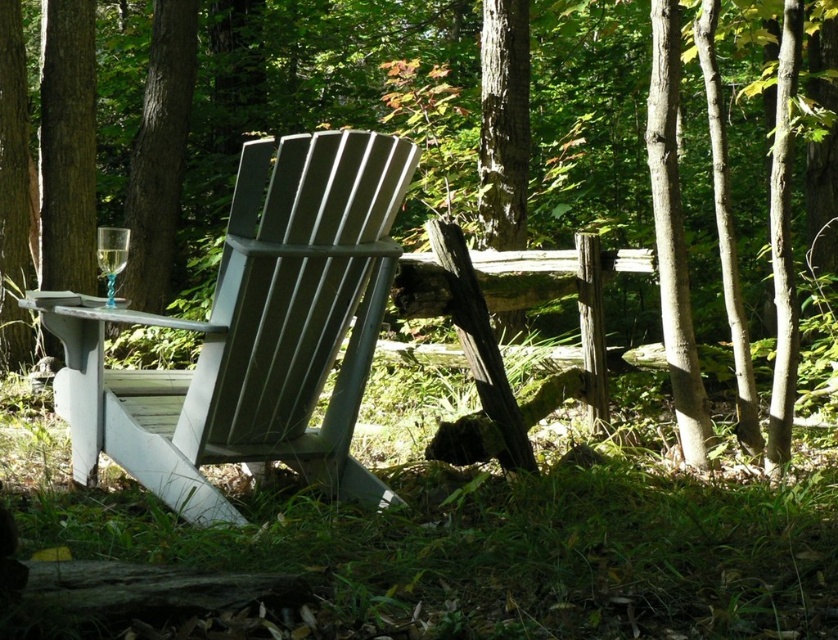
Question: Considering the real-world distances, which object is farthest from the green textured tree trunk at upper left?

Choices:
 (A) matte gray wood chair at center
 (B) clear glass wine glass at left

Answer: (A)

Question: Which object is farther from the camera taking this photo?

Choices:
 (A) matte gray wood chair at center
 (B) green textured tree trunk at upper left

Answer: (B)

Question: Among these objects, which one is farthest from the camera?

Choices:
 (A) matte gray wood chair at center
 (B) clear glass wine glass at left

Answer: (B)

Question: Is matte gray wood chair at center thinner than clear glass wine glass at left?

Choices:
 (A) yes
 (B) no

Answer: (B)

Question: Is matte gray wood chair at center to the right of green textured tree trunk at upper left from the viewer's perspective?

Choices:
 (A) yes
 (B) no

Answer: (A)

Question: In this image, where is green textured tree trunk at upper left located relative to clear glass wine glass at left?

Choices:
 (A) below
 (B) above

Answer: (B)